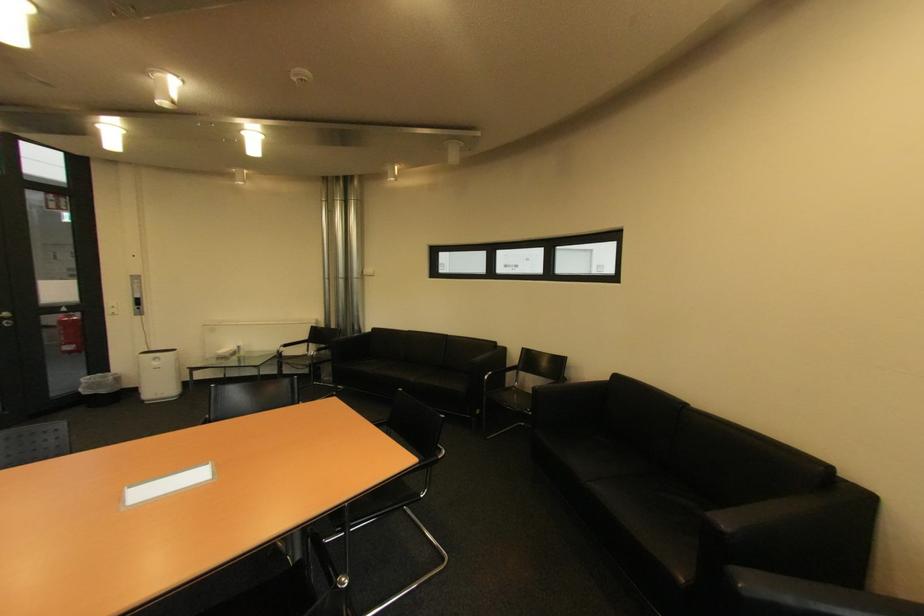
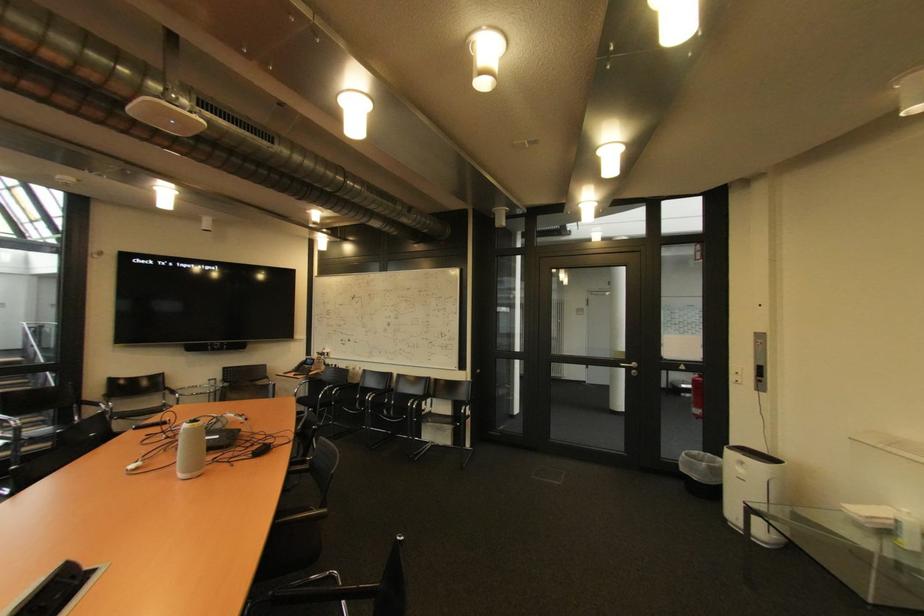
The point at (x=94, y=394) is marked in the first image. Where is the corresponding point in the second image?

(690, 471)